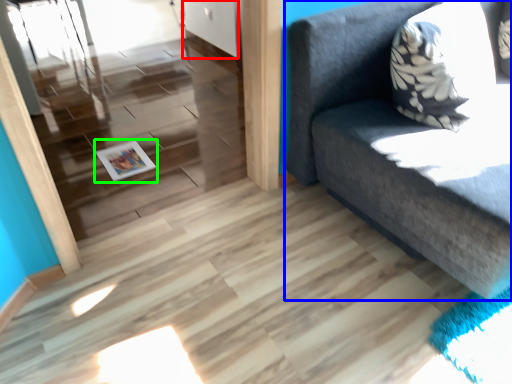
Question: Considering the real-world distances, which object is farthest from door (highlighted by a red box)? studio couch (highlighted by a blue box) or magazine (highlighted by a green box)?

Choices:
 (A) studio couch
 (B) magazine

Answer: (A)